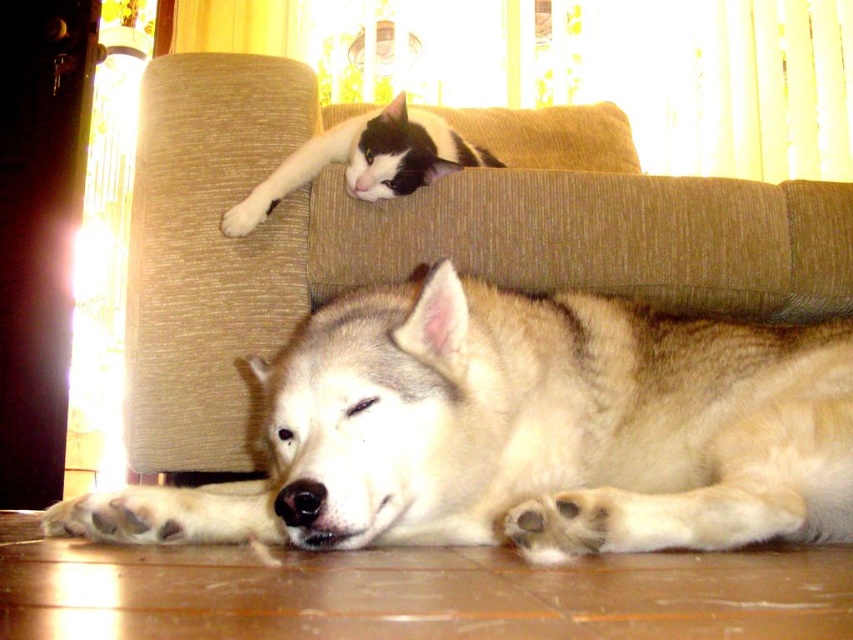
Who is positioned more to the left, black and white fur cat at upper center or white fur paw at upper left?

white fur paw at upper left is more to the left.

Is point (389, 138) closer to camera compared to point (251, 204)?

No.

Who is more distant from viewer, (421, 124) or (228, 211)?

The point (421, 124) is behind.

Find the location of a particular element. The width and height of the screenshot is (853, 640). black and white fur cat at upper center is located at coordinates (378, 154).

Who is positioned more to the right, fuzzy beige dog at lower center or white fur paw at upper left?

fuzzy beige dog at lower center is more to the right.

Can you confirm if fuzzy beige dog at lower center is positioned to the left of white fur paw at upper left?

Incorrect, fuzzy beige dog at lower center is not on the left side of white fur paw at upper left.

Between point (656, 337) and point (250, 225), which one is positioned in front?

Positioned in front is point (656, 337).

Where is `fuzzy beige dog at lower center`? This screenshot has width=853, height=640. fuzzy beige dog at lower center is located at coordinates (524, 429).

Does fuzzy beige dog at lower center appear over beige fabric couch at upper center?

Incorrect, fuzzy beige dog at lower center is not positioned above beige fabric couch at upper center.

Does fuzzy beige dog at lower center lie in front of beige fabric couch at upper center?

Yes, fuzzy beige dog at lower center is in front of beige fabric couch at upper center.

The height and width of the screenshot is (640, 853). In order to click on fuzzy beige dog at lower center in this screenshot , I will do `click(524, 429)`.

Find the location of a particular element. The height and width of the screenshot is (640, 853). fuzzy beige dog at lower center is located at coordinates (524, 429).